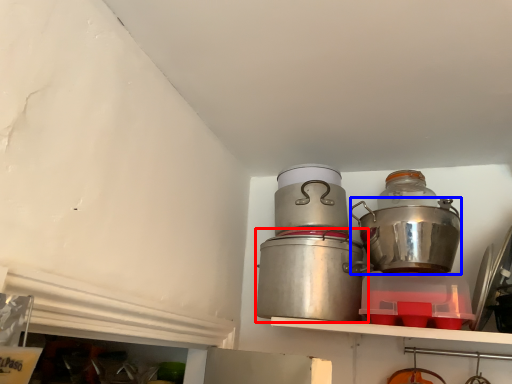
Question: Which object is further to the camera taking this photo, crock pot (highlighted by a red box) or crock pot (highlighted by a blue box)?

Choices:
 (A) crock pot
 (B) crock pot

Answer: (A)